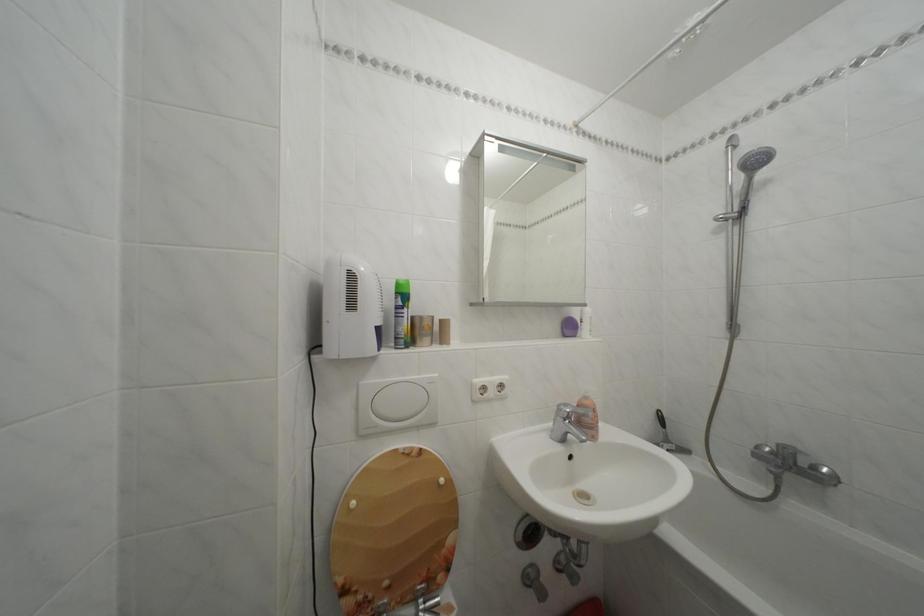
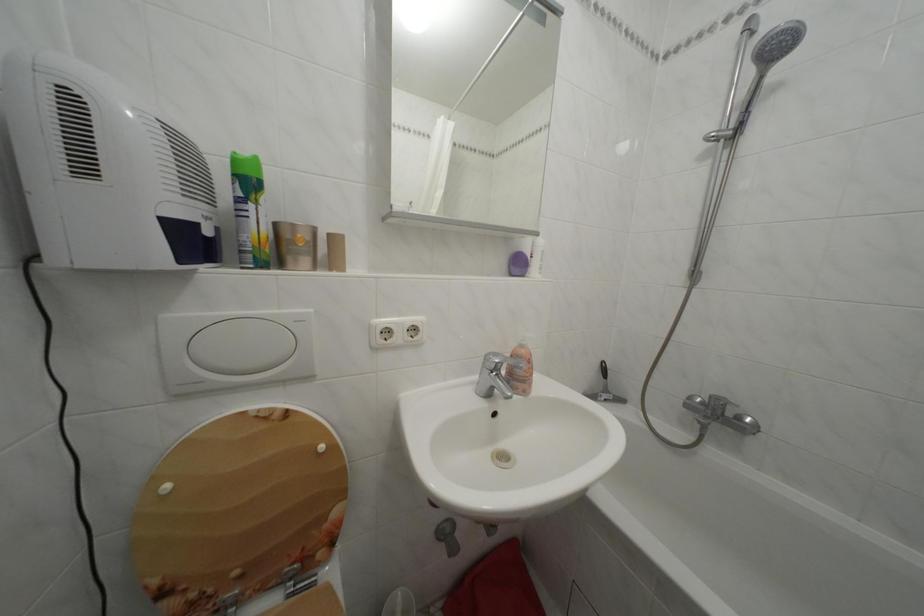
Question: How did the camera likely rotate?

Choices:
 (A) Left
 (B) Right
 (C) Up
 (D) Down

Answer: (D)